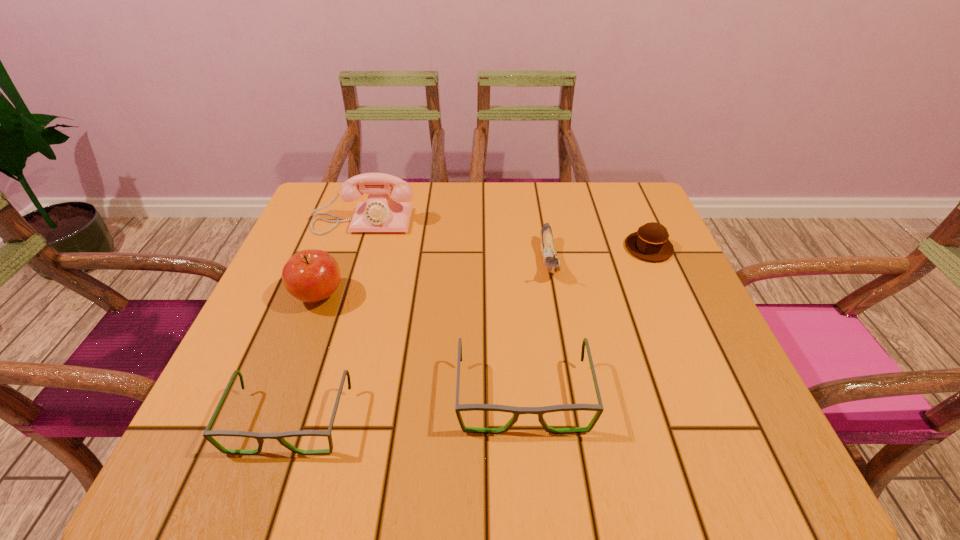
Locate an element on the screen. The height and width of the screenshot is (540, 960). unoccupied position between the rightmost object and the left spectacles is located at coordinates (469, 334).

Locate an element on the screen. This screenshot has height=540, width=960. vacant area that lies between the muffin and the taller spectacles is located at coordinates (586, 321).

This screenshot has height=540, width=960. In order to click on free area in between the muffin and the banana in this screenshot , I will do `click(599, 254)`.

The width and height of the screenshot is (960, 540). Find the location of `vacant space in between the telephone and the banana`. vacant space in between the telephone and the banana is located at coordinates click(456, 241).

You are a GUI agent. You are given a task and a screenshot of the screen. Output one action in this format:
    pyautogui.click(x=<x>, y=<y>)
    Task: Click on the unoccupied position between the left spectacles and the second tallest object
    The width and height of the screenshot is (960, 540).
    Given the screenshot: What is the action you would take?
    pyautogui.click(x=304, y=358)

Where is `vacant point located between the shorter spectacles and the second tallest object`? The height and width of the screenshot is (540, 960). vacant point located between the shorter spectacles and the second tallest object is located at coordinates (304, 358).

Image resolution: width=960 pixels, height=540 pixels. Find the location of `object that can be found as the third closest to the tallest object`. object that can be found as the third closest to the tallest object is located at coordinates (516, 411).

Find the location of `object that is the third closest one to the taller spectacles`. object that is the third closest one to the taller spectacles is located at coordinates (311, 275).